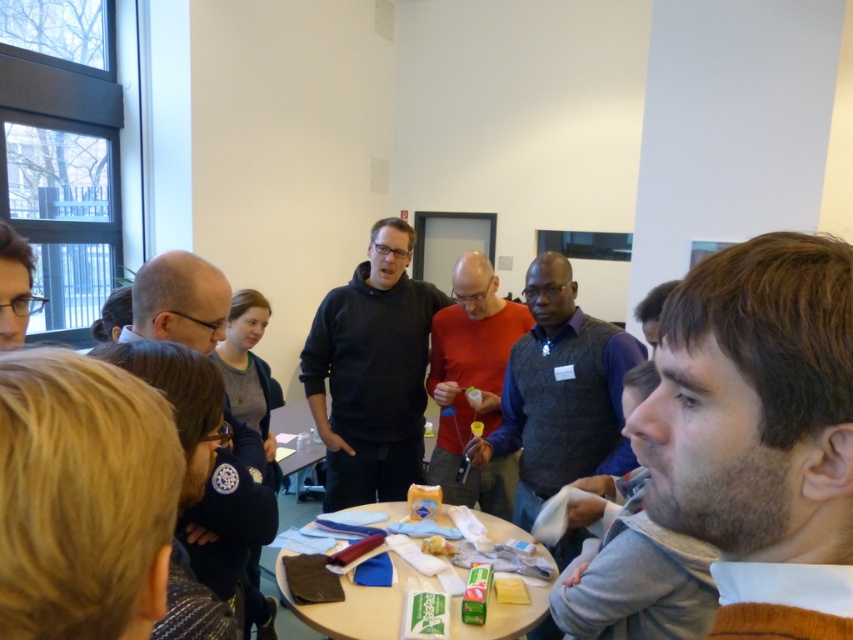
Question: Where is black matte sweater at center located in relation to yellow matte cheese at center in the image?

Choices:
 (A) below
 (B) above

Answer: (B)

Question: Which object appears farthest from the camera in this image?

Choices:
 (A) black matte jacket at left
 (B) wooden table at center
 (C) dark gray sweater at center

Answer: (B)

Question: Estimate the real-world distances between objects in this image. Which object is farther from the wooden table at center?

Choices:
 (A) black matte sweater at center
 (B) matte black laptop at center
 (C) matte red shirt at center
 (D) yellow matte cheese at center

Answer: (B)

Question: Can you confirm if black matte sweater at center is positioned below yellow matte cheese at center?

Choices:
 (A) no
 (B) yes

Answer: (A)

Question: Which object is positioned closest to the black matte jacket at left?

Choices:
 (A) matte red shirt at center
 (B) wooden table at center

Answer: (A)

Question: Is brown fuzzy hair at center further to camera compared to matte red shirt at center?

Choices:
 (A) no
 (B) yes

Answer: (A)